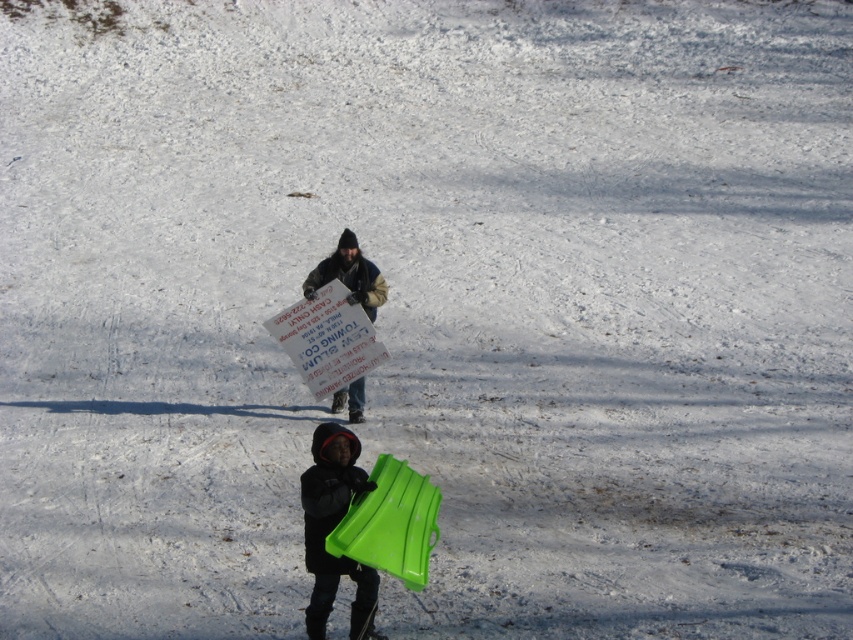
Can you confirm if matte green sled at lower center is positioned to the right of matte cardboard sign at center?

Indeed, matte green sled at lower center is positioned on the right side of matte cardboard sign at center.

Does matte green sled at lower center come in front of matte cardboard sign at center?

That is True.

Is point (312, 509) positioned behind point (363, 301)?

That is False.

Find the location of a particular element. Image resolution: width=853 pixels, height=640 pixels. matte green sled at lower center is located at coordinates (332, 529).